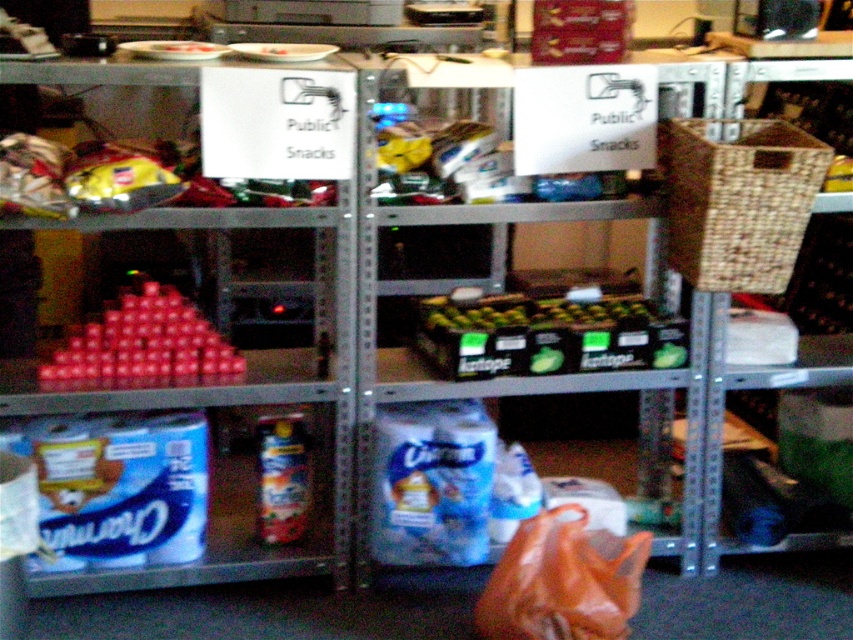
You are organizing items in a storage area and need to place an orange plastic bag at lower center and a blue cardboard charmin at lower left. The storage area has a strict rule that items must be placed at least 24 inches apart for safety. Based on their current positions, are they compliant with this rule?

The orange plastic bag at lower center and blue cardboard charmin at lower left are 22.56 inches apart from each other, which is less than the required 24 inches. Therefore, they are not compliant with the storage area safety rule.

You are organizing items in a storage area and need to place a new item between the blue cardboard charmin at lower left and the matte plastic cups at left. Considering their positions, where should you place the new item to ensure it is between them?

The blue cardboard charmin at lower left is in front of the matte plastic cups at left, so placing the new item between them would require positioning it behind the blue cardboard charmin at lower left but in front of the matte plastic cups at left.